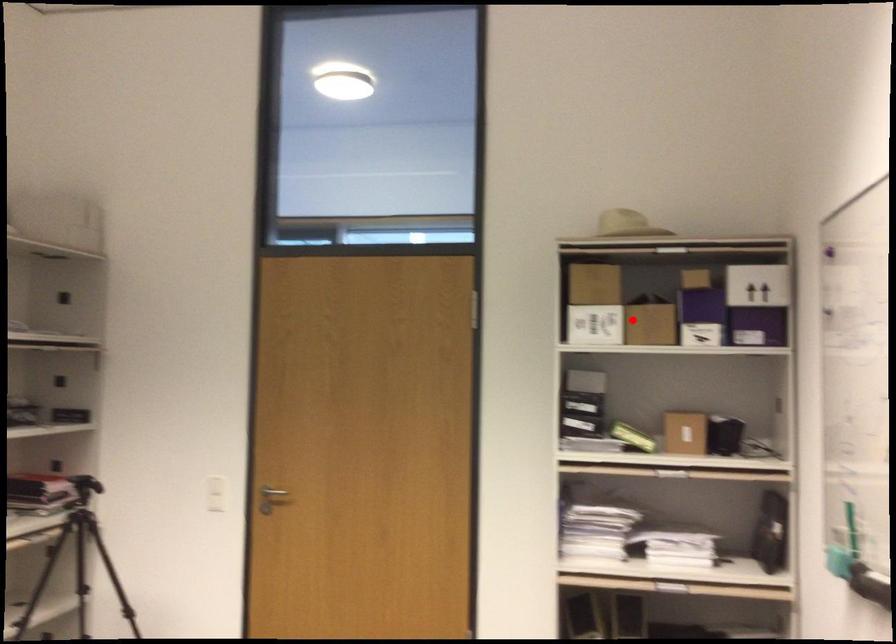
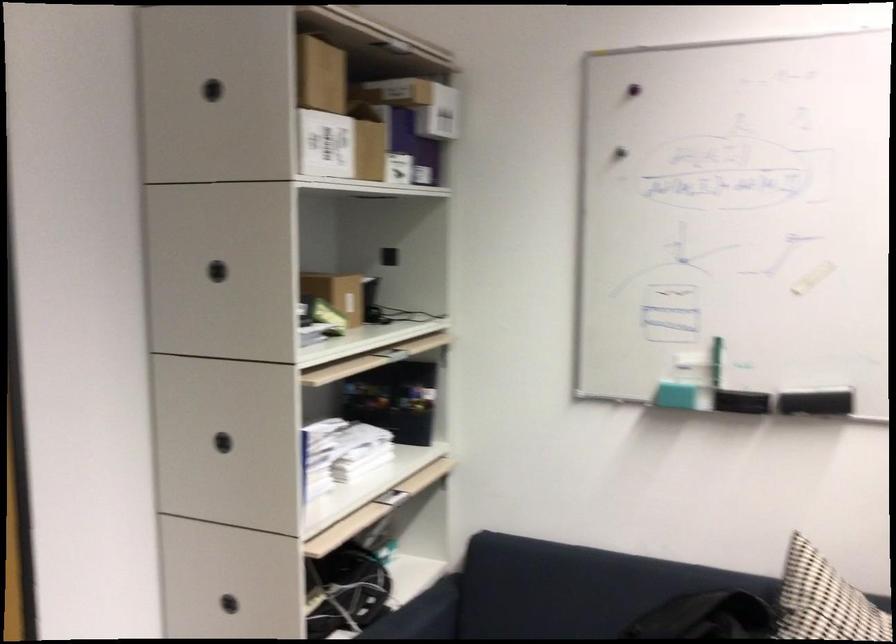
In the second image, find the point that corresponds to the highlighted location in the first image.

(340, 146)